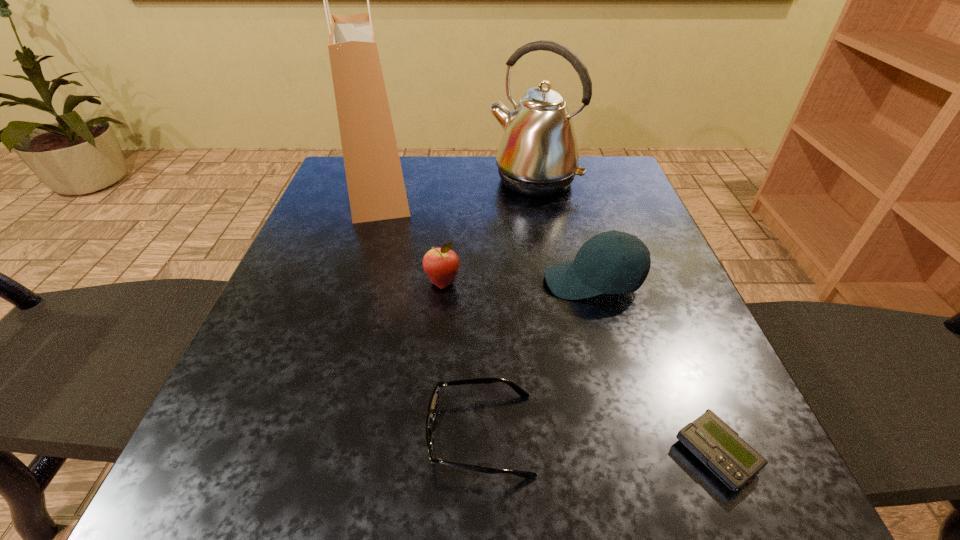
The width and height of the screenshot is (960, 540). I want to click on free space at the left edge, so click(368, 234).

You are a GUI agent. You are given a task and a screenshot of the screen. Output one action in this format:
    pyautogui.click(x=<x>, y=<y>)
    Task: Click on the vacant area at the right edge of the desktop
    The height and width of the screenshot is (540, 960).
    Given the screenshot: What is the action you would take?
    pyautogui.click(x=635, y=298)

At what (x,y) coordinates should I click in order to perform the action: click on vacant space at the near left corner. Please return your answer as a coordinate pair (x, y). Looking at the image, I should click on (183, 479).

The width and height of the screenshot is (960, 540). What are the coordinates of `blank area at the far right corner` in the screenshot? It's located at (602, 181).

The height and width of the screenshot is (540, 960). In order to click on free space at the near right corner in this screenshot , I will do `click(744, 522)`.

Find the location of a particular element. The height and width of the screenshot is (540, 960). free space between the tallest object and the baseball cap is located at coordinates (486, 234).

This screenshot has height=540, width=960. What are the coordinates of `empty location between the tallest object and the shortest object` in the screenshot? It's located at (547, 321).

Where is `free space between the apple and the fifth tallest object`? This screenshot has height=540, width=960. free space between the apple and the fifth tallest object is located at coordinates (462, 358).

You are a GUI agent. You are given a task and a screenshot of the screen. Output one action in this format:
    pyautogui.click(x=<x>, y=<y>)
    Task: Click on the free space between the spectacles and the kettle
    
    Given the screenshot: What is the action you would take?
    [507, 307]

What are the coordinates of `unoccupied position between the second shortest object and the baseball cap` in the screenshot? It's located at (537, 358).